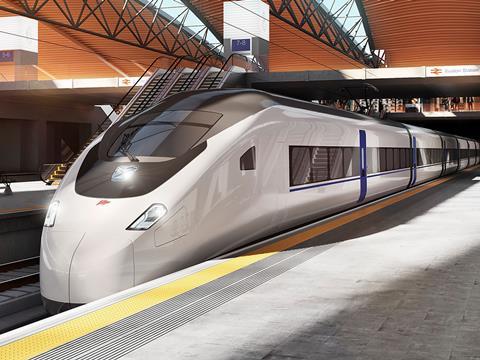
The image size is (480, 360). What are the coordinates of `window` in the screenshot? It's located at (319, 160), (399, 161).